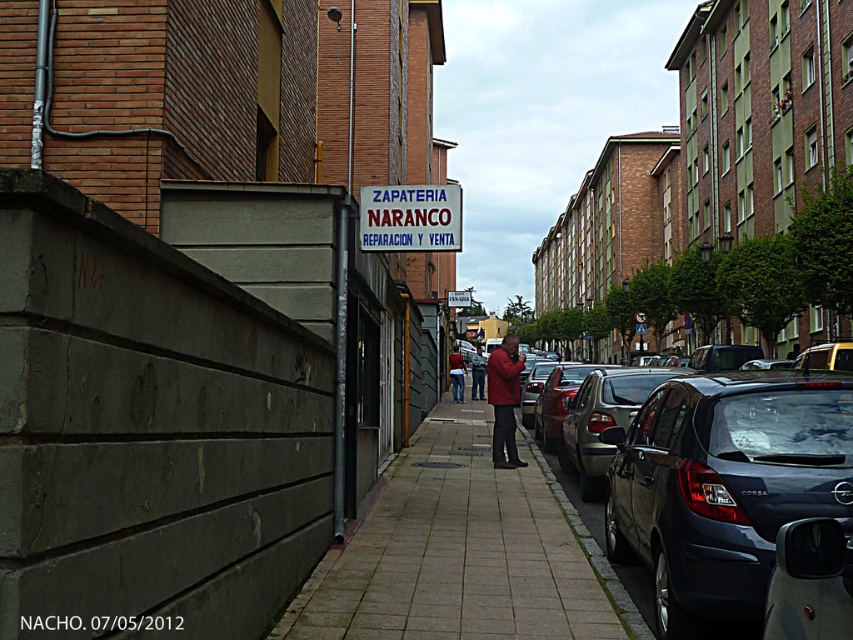
Question: Is matte black corsa at center in front of white plastic sign at center?

Choices:
 (A) yes
 (B) no

Answer: (A)

Question: Among these points, which one is farthest from the camera?

Choices:
 (A) (453, 364)
 (B) (480, 397)

Answer: (B)

Question: Which object is closer to the camera taking this photo?

Choices:
 (A) matte red jacket at center
 (B) matte black corsa at center
 (C) dark blue jeans at center

Answer: (B)

Question: Is white plastic sign at center to the left of matte red jacket at center from the viewer's perspective?

Choices:
 (A) yes
 (B) no

Answer: (A)

Question: Which of the following is the closest to the observer?

Choices:
 (A) (672, 420)
 (B) (492, 429)

Answer: (A)

Question: Can you confirm if matte black corsa at center is smaller than red leather jacket at center?

Choices:
 (A) no
 (B) yes

Answer: (B)